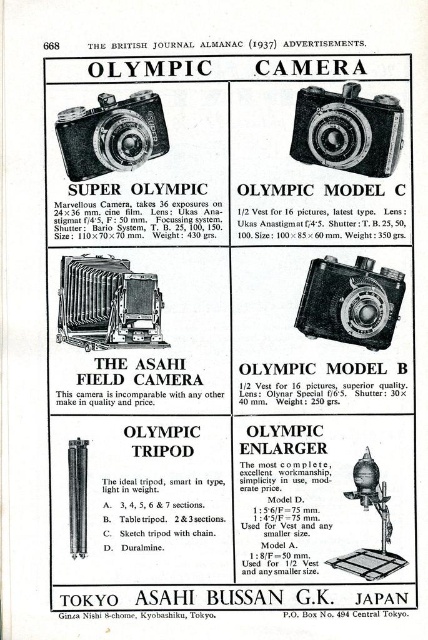
Question: Is matte black camera at center smaller than matte black camera at upper left?

Choices:
 (A) yes
 (B) no

Answer: (A)

Question: Does black plastic camera at upper right appear on the left side of metallic silver enlarger at lower right?

Choices:
 (A) no
 (B) yes

Answer: (B)

Question: Can you confirm if matte black field camera at center is positioned above matte black camera at upper left?

Choices:
 (A) no
 (B) yes

Answer: (A)

Question: Which point is farther to the camera?

Choices:
 (A) matte black field camera at center
 (B) matte black camera at center
 (C) matte black camera at upper left

Answer: (A)

Question: Which point is closer to the camera taking this photo?

Choices:
 (A) (98, 342)
 (B) (386, 273)
 (C) (357, 465)

Answer: (C)

Question: Which object is farther from the camera taking this photo?

Choices:
 (A) black plastic camera at upper right
 (B) matte black camera at center
 (C) metallic silver enlarger at lower right

Answer: (B)